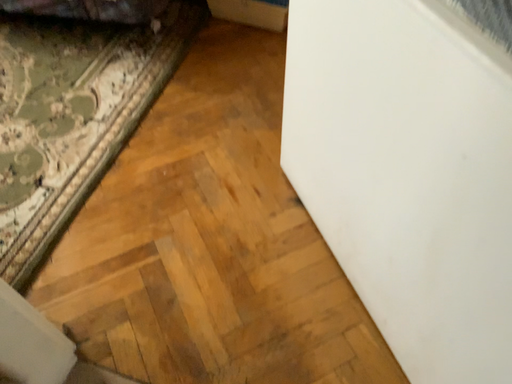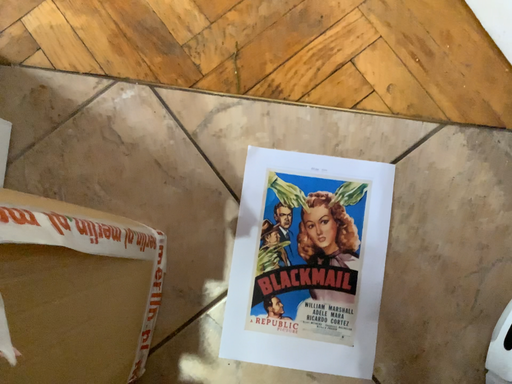
Question: Which way did the camera rotate in the video?

Choices:
 (A) rotated upward
 (B) rotated downward

Answer: (B)